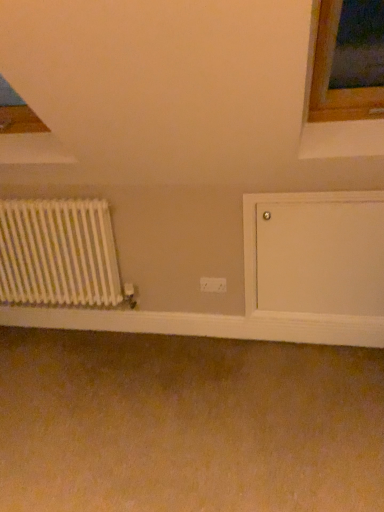
Question: Would you say white plastic electric outlet at center is to the left or to the right of white matte radiator at left in the picture?

Choices:
 (A) left
 (B) right

Answer: (B)

Question: From the image's perspective, relative to white matte radiator at left, is white plastic electric outlet at center above or below?

Choices:
 (A) below
 (B) above

Answer: (A)

Question: Considering the real-world distances, which object is closest to the white smooth wood at lower center?

Choices:
 (A) white plastic electric outlet at center
 (B) white matte radiator at left

Answer: (B)

Question: Based on their relative distances, which object is nearer to the white smooth wood at lower center?

Choices:
 (A) white matte radiator at left
 (B) white plastic electric outlet at center

Answer: (A)